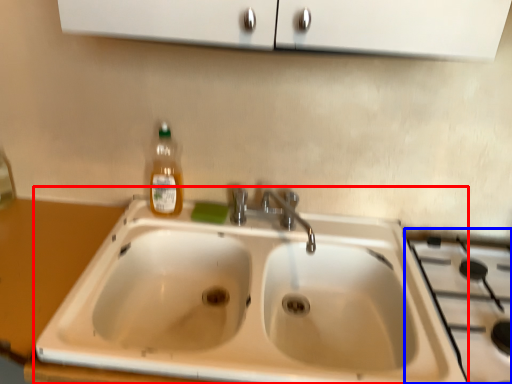
Question: Which of the following is the closest to the observer, sink (highlighted by a red box) or gas stove (highlighted by a blue box)?

Choices:
 (A) sink
 (B) gas stove

Answer: (A)